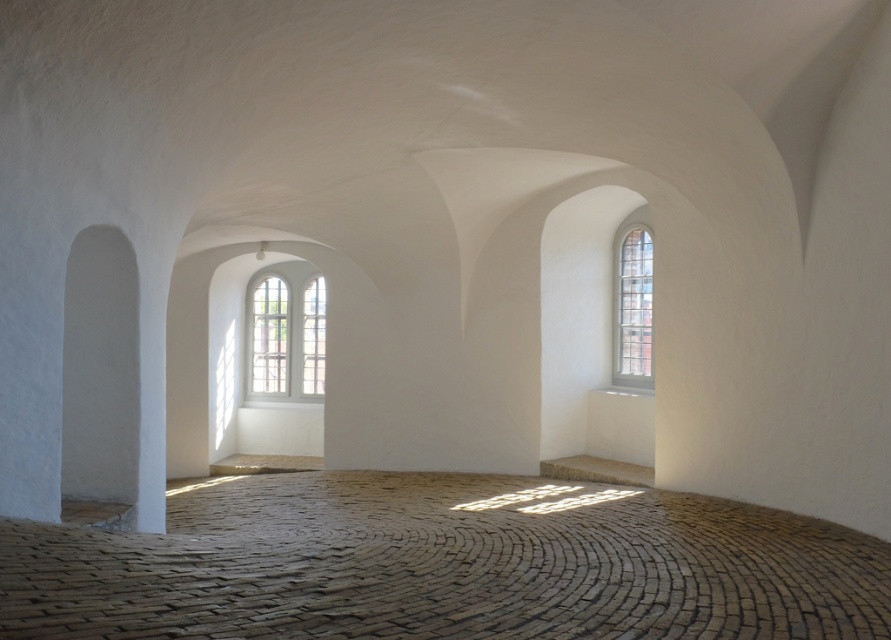
Between white wooden window at center and clear glass window at right, which one has less height?

clear glass window at right

Which is in front, point (321, 342) or point (648, 353)?

Point (648, 353) is in front.

Is point (300, 269) positioned after point (643, 328)?

Yes, point (300, 269) is farther from viewer.

You are a GUI agent. You are given a task and a screenshot of the screen. Output one action in this format:
    pyautogui.click(x=<x>, y=<y>)
    Task: Click on the white wooden window at center
    This screenshot has height=640, width=891.
    Given the screenshot: What is the action you would take?
    pyautogui.click(x=285, y=332)